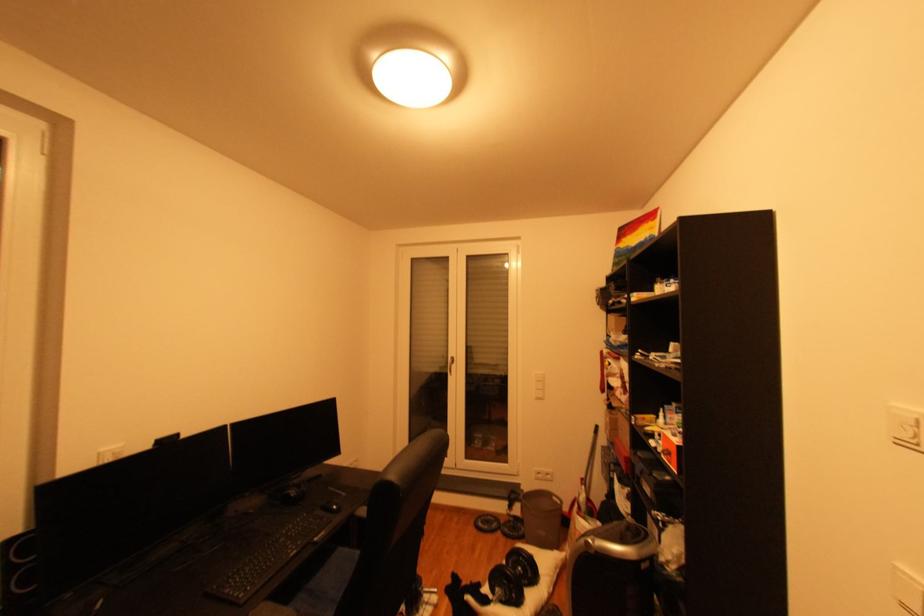
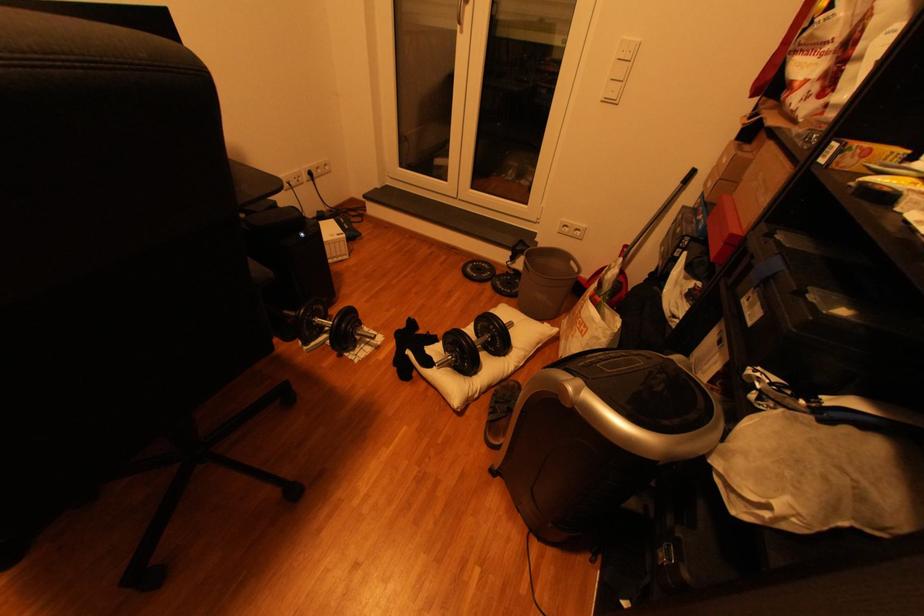
In the second image, find the point that corresponds to point (492, 524) in the first image.

(482, 270)